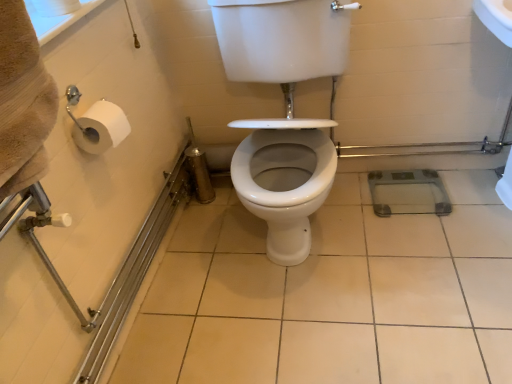
The image size is (512, 384). Describe the element at coordinates (333, 295) in the screenshot. I see `white glossy ceramic tile at center` at that location.

Locate an element on the screen. The image size is (512, 384). white glossy ceramic tile at center is located at coordinates pyautogui.click(x=333, y=295).

The image size is (512, 384). Describe the element at coordinates (286, 107) in the screenshot. I see `white glossy toilet seat at center` at that location.

In order to face white glossy toilet seat at center, should I rotate leftwards or rightwards?

Rotate right and turn 4.366 degrees.

What are the coordinates of `white glossy toilet seat at center` in the screenshot? It's located at (286, 107).

What is the approximate width of white glossy toilet seat at center?

28.89 inches.

Where is `white glossy ceramic tile at center`? The width and height of the screenshot is (512, 384). white glossy ceramic tile at center is located at coordinates (333, 295).

Would you say white glossy ceramic tile at center is to the left or to the right of white glossy toilet seat at center in the picture?

From the image, it's evident that white glossy ceramic tile at center is to the right of white glossy toilet seat at center.

Does white glossy ceramic tile at center come behind white glossy toilet seat at center?

Yes, the depth of white glossy ceramic tile at center is greater than that of white glossy toilet seat at center.

Considering the positions of point (168, 336) and point (228, 25), is point (168, 336) closer or farther from the camera than point (228, 25)?

Point (168, 336) appears to be closer to the viewer than point (228, 25).

From the image's perspective, between white glossy ceramic tile at center and white glossy toilet seat at center, who is located below?

white glossy ceramic tile at center, from the image's perspective.

From a real-world perspective, is white glossy ceramic tile at center over white glossy toilet seat at center?

No, from a real-world perspective, white glossy ceramic tile at center is not over white glossy toilet seat at center

In the scene shown: Considering the sizes of white glossy ceramic tile at center and white glossy toilet seat at center in the image, is white glossy ceramic tile at center wider or thinner than white glossy toilet seat at center?

white glossy ceramic tile at center is wider than white glossy toilet seat at center.

In the scene shown: Considering the sizes of objects white glossy ceramic tile at center and white glossy toilet seat at center in the image provided, who is shorter, white glossy ceramic tile at center or white glossy toilet seat at center?

white glossy ceramic tile at center is shorter.

Considering the sizes of objects white glossy ceramic tile at center and white glossy toilet seat at center in the image provided, who is smaller, white glossy ceramic tile at center or white glossy toilet seat at center?

white glossy ceramic tile at center is smaller.

In the scene shown: Is white glossy ceramic tile at center not inside white glossy toilet seat at center?

Yes, white glossy ceramic tile at center is outside of white glossy toilet seat at center.

Is the surface of white glossy ceramic tile at center in direct contact with white glossy toilet seat at center?

white glossy ceramic tile at center and white glossy toilet seat at center are not in contact.

Is white glossy ceramic tile at center turned away from white glossy toilet seat at center?

white glossy ceramic tile at center is not turned away from white glossy toilet seat at center.

What's the angular difference between white glossy ceramic tile at center and white glossy toilet seat at center's facing directions?

88.7 degrees.

The image size is (512, 384). Identify the location of ceramic tile below the white glossy toilet seat at center (from the image's perspective). (333, 295).

Considering the relative positions of white glossy toilet seat at center and white glossy ceramic tile at center in the image provided, is white glossy toilet seat at center to the left or to the right of white glossy ceramic tile at center?

Clearly, white glossy toilet seat at center is on the left of white glossy ceramic tile at center in the image.

Relative to white glossy ceramic tile at center, is white glossy toilet seat at center in front or behind?

white glossy toilet seat at center is positioned closer to the viewer than white glossy ceramic tile at center.

Which is behind, point (257, 198) or point (201, 259)?

Positioned behind is point (201, 259).

Based on the photo, from the image's perspective, is white glossy toilet seat at center above or below white glossy ceramic tile at center?

From the image's perspective, white glossy toilet seat at center appears above white glossy ceramic tile at center.

From a real-world perspective, is white glossy toilet seat at center positioned under white glossy ceramic tile at center based on gravity?

No, from a real-world perspective, white glossy toilet seat at center is not under white glossy ceramic tile at center.

Considering the relative sizes of white glossy toilet seat at center and white glossy ceramic tile at center in the image provided, is white glossy toilet seat at center thinner than white glossy ceramic tile at center?

Yes, white glossy toilet seat at center is thinner than white glossy ceramic tile at center.

Who is shorter, white glossy toilet seat at center or white glossy ceramic tile at center?

white glossy ceramic tile at center is shorter.

Is white glossy toilet seat at center bigger than white glossy ceramic tile at center?

Yes.

Is white glossy toilet seat at center spatially inside white glossy ceramic tile at center, or outside of it?

white glossy toilet seat at center is spatially situated outside white glossy ceramic tile at center.

Does white glossy toilet seat at center touch white glossy ceramic tile at center?

They are not placed beside each other.

Does white glossy toilet seat at center turn towards white glossy ceramic tile at center?

No.

You are a GUI agent. You are given a task and a screenshot of the screen. Output one action in this format:
    pyautogui.click(x=<x>, y=<y>)
    Task: Click on the sit in front of the white glossy ceramic tile at center
    The height and width of the screenshot is (384, 512).
    Given the screenshot: What is the action you would take?
    pyautogui.click(x=286, y=107)

Identify the location of ceramic tile lying below the white glossy toilet seat at center (from the image's perspective). (333, 295).

At what (x,y) coordinates should I click in order to perform the action: click on sit located above the white glossy ceramic tile at center (from the image's perspective). Please return your answer as a coordinate pair (x, y). Image resolution: width=512 pixels, height=384 pixels. Looking at the image, I should click on (286, 107).